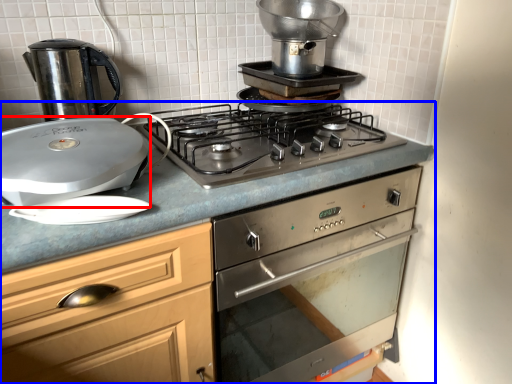
Question: Which object is closer to the camera taking this photo, kitchen appliance (highlighted by a red box) or countertop (highlighted by a blue box)?

Choices:
 (A) kitchen appliance
 (B) countertop

Answer: (B)